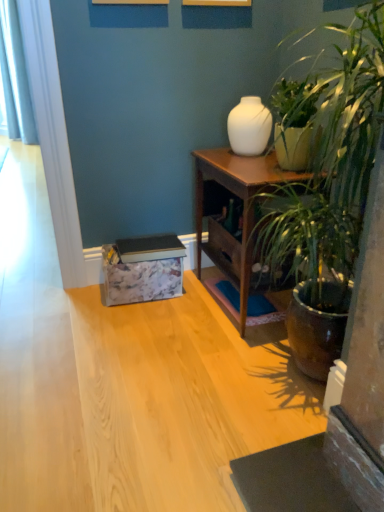
What is the approximate height of wooden nightstand at center-right?

The height of wooden nightstand at center-right is 27.89 inches.

The image size is (384, 512). What do you see at coordinates (331, 153) in the screenshot?
I see `green leafy plant at right` at bounding box center [331, 153].

What do you see at coordinates (249, 127) in the screenshot?
I see `white glossy vase at upper center` at bounding box center [249, 127].

Find the location of `wooden nightstand at center-right`. wooden nightstand at center-right is located at coordinates (243, 209).

From the picture: From the image's perspective, between wooden nightstand at center-right and green leafy plant at right, which one is located above?

green leafy plant at right.

In the scene shown: From a real-world perspective, between wooden nightstand at center-right and green leafy plant at right, who is vertically lower?

wooden nightstand at center-right, from a real-world perspective.

Can you confirm if wooden nightstand at center-right is smaller than green leafy plant at right?

Yes, wooden nightstand at center-right is smaller than green leafy plant at right.

Is wooden nightstand at center-right at the right side of green leafy plant at right?

No, wooden nightstand at center-right is not to the right of green leafy plant at right.

Image resolution: width=384 pixels, height=512 pixels. I want to click on houseplant in front of the wooden nightstand at center-right, so click(331, 153).

Is wooden nightstand at center-right completely or partially inside green leafy plant at right?

No, wooden nightstand at center-right is not a part of green leafy plant at right.

Does green leafy plant at right have a smaller size compared to wooden nightstand at center-right?

No, green leafy plant at right is not smaller than wooden nightstand at center-right.

Considering the relative positions of white fabric curtain at left and wooden nightstand at center-right in the image provided, is white fabric curtain at left to the left or to the right of wooden nightstand at center-right?

From the image, it's evident that white fabric curtain at left is to the left of wooden nightstand at center-right.

Does white fabric curtain at left turn towards wooden nightstand at center-right?

No, white fabric curtain at left does not turn towards wooden nightstand at center-right.

Which object is closer to the camera taking this photo, white fabric curtain at left or wooden nightstand at center-right?

wooden nightstand at center-right.

From a real-world perspective, is white fabric curtain at left physically above wooden nightstand at center-right?

Indeed, from a real-world perspective, white fabric curtain at left stands above wooden nightstand at center-right.

Is white fabric curtain at left outside of white glossy vase at upper center?

white fabric curtain at left lies outside white glossy vase at upper center's area.

Does white fabric curtain at left have a lesser height compared to white glossy vase at upper center?

No.

From the image's perspective, is white fabric curtain at left above or below white glossy vase at upper center?

white fabric curtain at left is situated higher than white glossy vase at upper center in the image.

Is white fabric curtain at left wider than white glossy vase at upper center?

Indeed, white fabric curtain at left has a greater width compared to white glossy vase at upper center.

Which of these two, white glossy vase at upper center or white fabric curtain at left, is thinner?

white glossy vase at upper center is thinner.

From a real-world perspective, is white glossy vase at upper center above or below white fabric curtain at left?

From a real-world perspective, white glossy vase at upper center is physically below white fabric curtain at left.

Is white glossy vase at upper center inside or outside of white fabric curtain at left?

white glossy vase at upper center is spatially situated outside white fabric curtain at left.

In terms of height, does white glossy vase at upper center look taller or shorter compared to white fabric curtain at left?

Considering their sizes, white glossy vase at upper center has less height than white fabric curtain at left.

Considering the relative sizes of wooden nightstand at center-right and white glossy vase at upper center in the image provided, is wooden nightstand at center-right shorter than white glossy vase at upper center?

In fact, wooden nightstand at center-right may be taller than white glossy vase at upper center.

Is wooden nightstand at center-right wider or thinner than white glossy vase at upper center?

Considering their sizes, wooden nightstand at center-right looks broader than white glossy vase at upper center.

Which object is more forward, wooden nightstand at center-right or white glossy vase at upper center?

wooden nightstand at center-right is in front.

Does point (223, 263) appear closer or farther from the camera than point (10, 114)?

Clearly, point (223, 263) is closer to the camera than point (10, 114).

Is wooden nightstand at center-right with white fabric curtain at left?

No, wooden nightstand at center-right is not making contact with white fabric curtain at left.

In the scene shown: Is wooden nightstand at center-right oriented towards white fabric curtain at left?

No, wooden nightstand at center-right is not turned towards white fabric curtain at left.

How different are the orientations of wooden nightstand at center-right and white fabric curtain at left in degrees?

wooden nightstand at center-right and white fabric curtain at left are facing 44 degrees away from each other.

The height and width of the screenshot is (512, 384). What are the coordinates of `nightstand below the green leafy plant at right (from the image's perspective)` in the screenshot? It's located at (243, 209).

You are a GUI agent. You are given a task and a screenshot of the screen. Output one action in this format:
    pyautogui.click(x=<x>, y=<y>)
    Task: Click on the houseplant above the wooden nightstand at center-right (from a real-world perspective)
    
    Given the screenshot: What is the action you would take?
    pyautogui.click(x=331, y=153)

Looking at the image, which one is located further to white fabric curtain at left, green leafy plant at right or white glossy vase at upper center?

green leafy plant at right.

Estimate the real-world distances between objects in this image. Which object is closer to green leafy plant at right, white fabric curtain at left or wooden nightstand at center-right?

Based on the image, wooden nightstand at center-right appears to be nearer to green leafy plant at right.

When comparing their distances from wooden nightstand at center-right, does green leafy plant at right or white fabric curtain at left seem closer?

green leafy plant at right.

Considering their positions, is green leafy plant at right positioned closer to white fabric curtain at left than wooden nightstand at center-right?

wooden nightstand at center-right.

Which object lies further to the anchor point wooden nightstand at center-right, white fabric curtain at left or green leafy plant at right?

Among the two, white fabric curtain at left is located further to wooden nightstand at center-right.

Consider the image. Which object lies further to the anchor point white fabric curtain at left, wooden nightstand at center-right or white glossy vase at upper center?

Based on the image, white glossy vase at upper center appears to be further to white fabric curtain at left.

Based on their spatial positions, is white fabric curtain at left or white glossy vase at upper center closer to wooden nightstand at center-right?

white glossy vase at upper center.

Looking at the image, which one is located closer to wooden nightstand at center-right, white glossy vase at upper center or green leafy plant at right?

white glossy vase at upper center lies closer to wooden nightstand at center-right than the other object.

This screenshot has height=512, width=384. Find the location of `vase positioned between green leafy plant at right and white fabric curtain at left from near to far`. vase positioned between green leafy plant at right and white fabric curtain at left from near to far is located at coordinates (249, 127).

Find the location of a particular element. vase located between wooden nightstand at center-right and white fabric curtain at left in the depth direction is located at coordinates (249, 127).

I want to click on nightstand positioned between green leafy plant at right and white glossy vase at upper center from near to far, so click(243, 209).

At what (x,y) coordinates should I click in order to perform the action: click on nightstand between green leafy plant at right and white fabric curtain at left along the z-axis. Please return your answer as a coordinate pair (x, y). The height and width of the screenshot is (512, 384). Looking at the image, I should click on (243, 209).